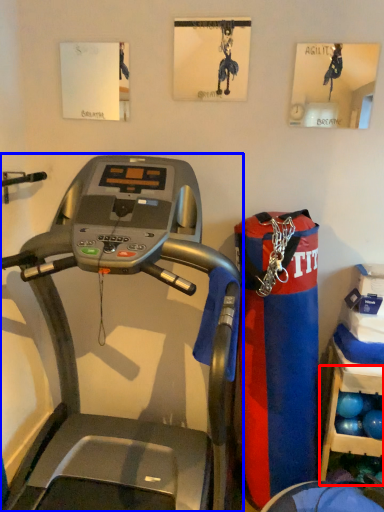
Question: Among these objects, which one is nearest to the camera, shelf (highlighted by a red box) or treadmill (highlighted by a blue box)?

Choices:
 (A) shelf
 (B) treadmill

Answer: (B)